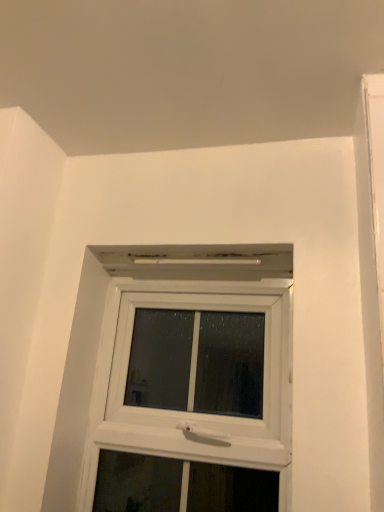
Identify the location of white plastic window at center. The height and width of the screenshot is (512, 384). [192, 381].

What do you see at coordinates (192, 381) in the screenshot? I see `white plastic window at center` at bounding box center [192, 381].

At what (x,y) coordinates should I click in order to perform the action: click on white plastic window at center. Please return your answer as a coordinate pair (x, y). The image size is (384, 512). Looking at the image, I should click on (192, 381).